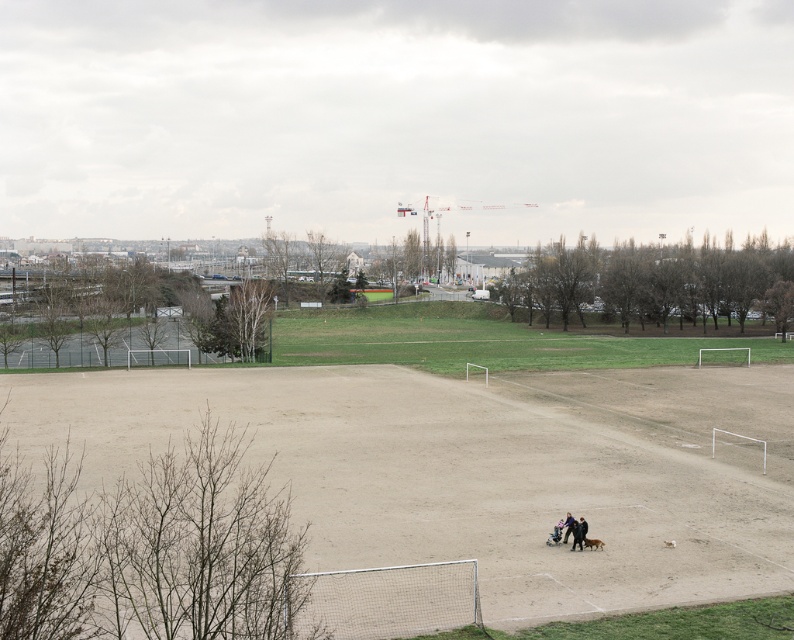
Question: Is dark blue jeans at lower center above dark blue jeans at center?

Choices:
 (A) no
 (B) yes

Answer: (A)

Question: Which of these objects is positioned closest to the brown sandy dirt field at center?

Choices:
 (A) dark blue jeans at lower center
 (B) dark blue jeans at center
 (C) matte black couple at lower right

Answer: (C)

Question: Which point is farther to the camera?

Choices:
 (A) (656, 378)
 (B) (565, 532)
 (C) (557, 525)

Answer: (A)

Question: Estimate the real-world distances between objects in this image. Which object is farther from the dark blue jeans at lower center?

Choices:
 (A) dark blue jeans at center
 (B) brown sandy dirt field at center

Answer: (B)

Question: From the image, what is the correct spatial relationship of matte black couple at lower right in relation to dark blue jeans at lower center?

Choices:
 (A) left
 (B) right

Answer: (A)

Question: Can you confirm if matte black couple at lower right is positioned to the right of dark blue jeans at center?

Choices:
 (A) no
 (B) yes

Answer: (A)